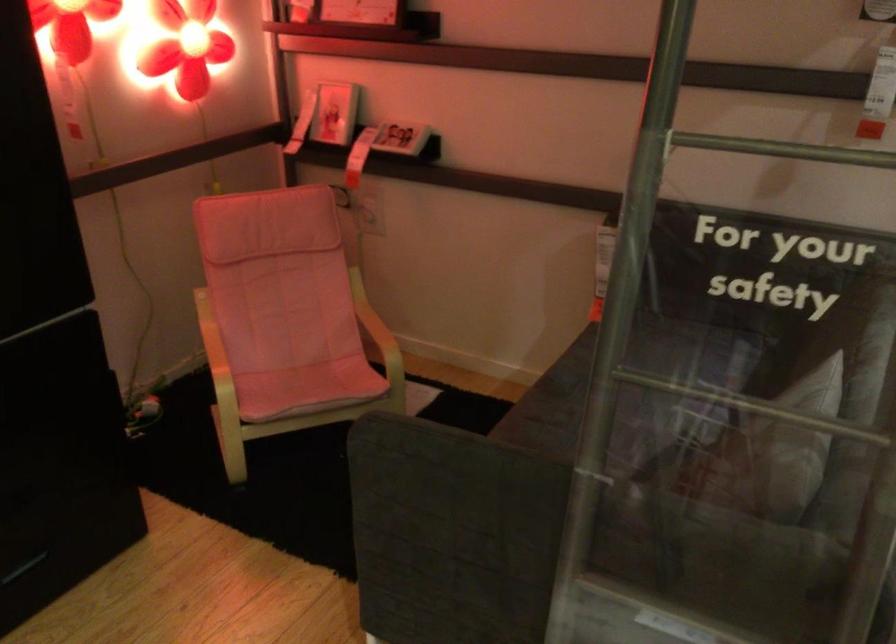
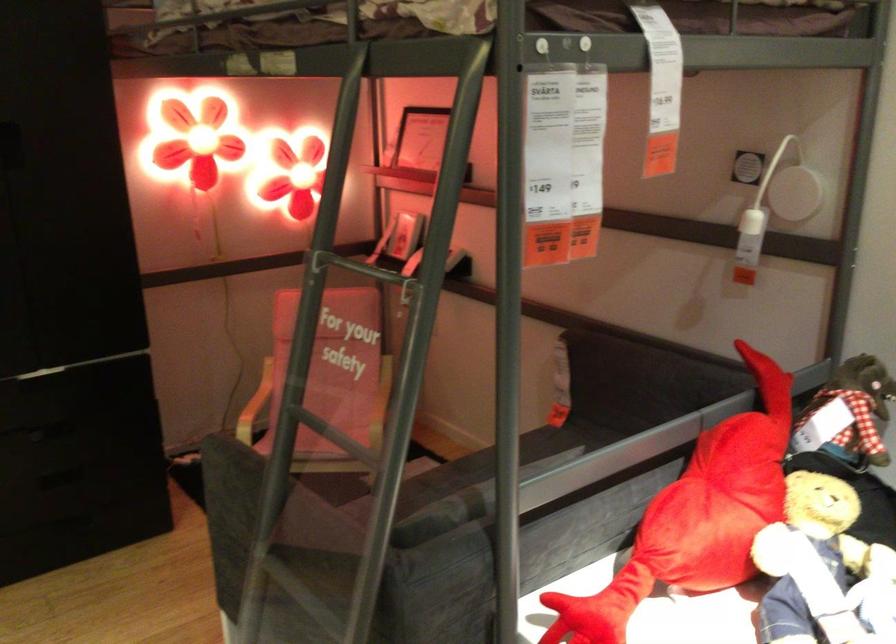
Find the pixel in the second image that matches point 643,330 in the first image.

(567, 437)